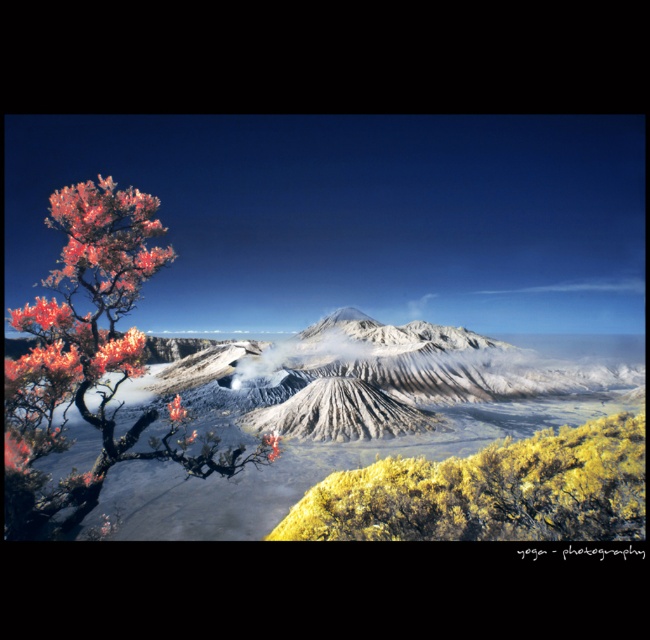
Is point (112, 248) closer to viewer compared to point (515, 477)?

That is True.

Consider the image. Does fluorescent orange bark at left appear over yellow-green shrubbery at lower right?

Correct, fluorescent orange bark at left is located above yellow-green shrubbery at lower right.

Which is in front, point (130, 204) or point (283, 520)?

Point (130, 204) is more forward.

Locate an element on the screen. fluorescent orange bark at left is located at coordinates (92, 362).